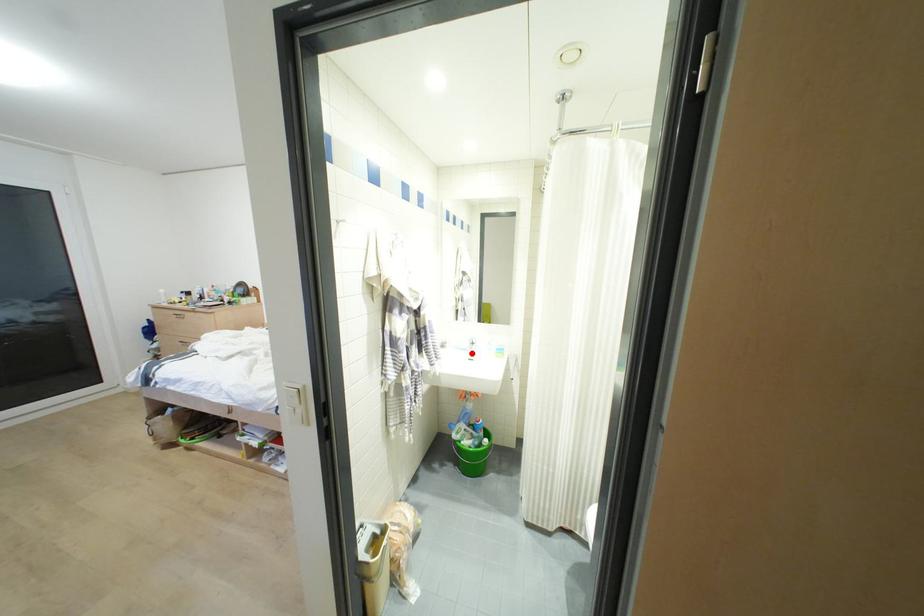
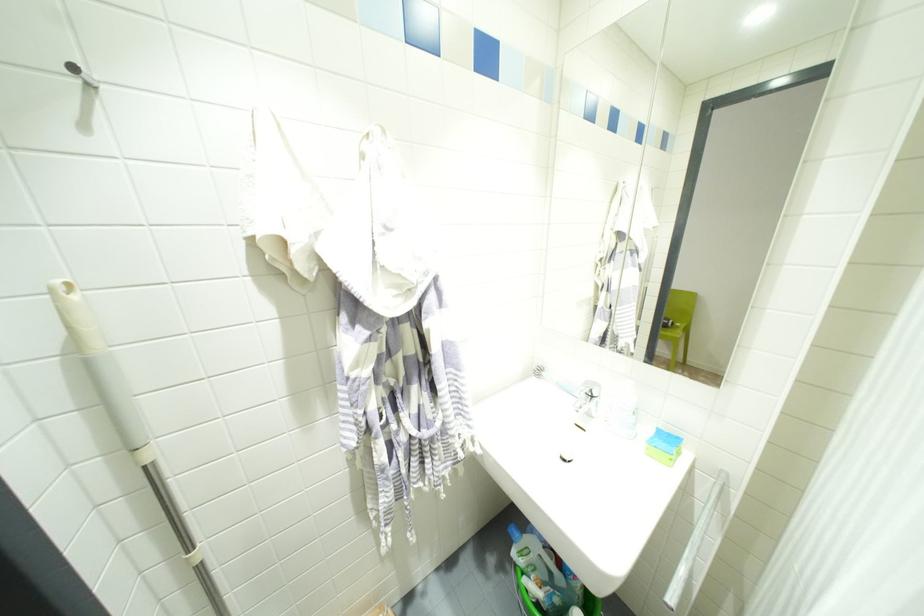
Find the pixel in the second image that matches the highlighted location in the first image.

(589, 415)